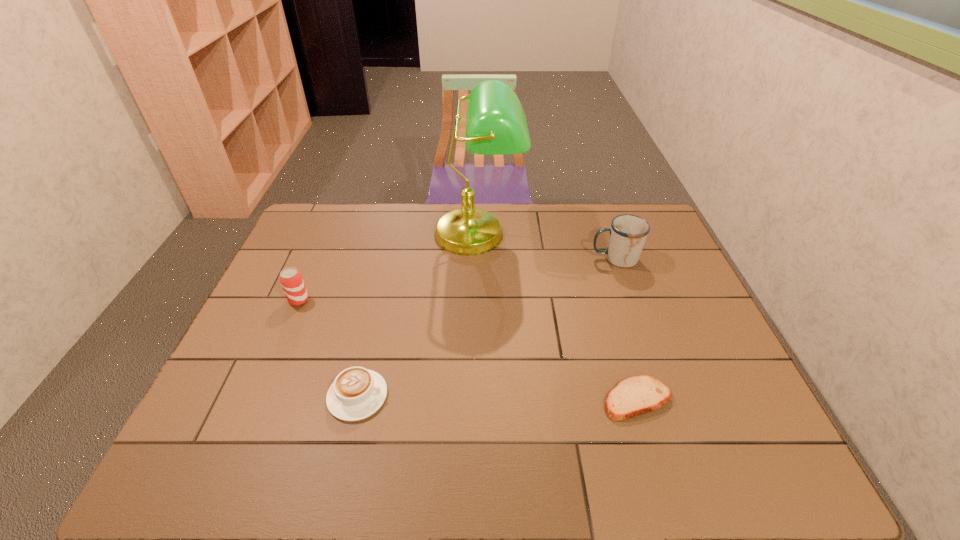
Locate an element on the screen. The image size is (960, 540). unoccupied area between the fourth tallest object and the shortest object is located at coordinates (497, 397).

The height and width of the screenshot is (540, 960). I want to click on vacant point located between the shortest object and the third object from left to right, so click(x=557, y=316).

Locate which object is the third closest to the cappuccino. Please provide its 2D coordinates. Your answer should be formatted as a tuple, i.e. [(x, y)], where the tuple contains the x and y coordinates of a point satisfying the conditions above.

[(637, 395)]

Identify the location of the second closest object to the pita bread. The height and width of the screenshot is (540, 960). (496, 124).

Where is `free space in the image that satisfies the following two spatial constraints: 1. on the desk next to the lamp; 2. with the handle on the right side of the fourth tallest object`? free space in the image that satisfies the following two spatial constraints: 1. on the desk next to the lamp; 2. with the handle on the right side of the fourth tallest object is located at coordinates (476, 396).

Find the location of a particular element. Image resolution: width=960 pixels, height=540 pixels. vacant area that satisfies the following two spatial constraints: 1. with the handle on the right side of the fourth object from right to left; 2. on the left side of the shortest object is located at coordinates (357, 399).

I want to click on free spot that satisfies the following two spatial constraints: 1. on the desk next to the third object from left to right; 2. with the handle on the right side of the fourth tallest object, so click(x=476, y=396).

This screenshot has width=960, height=540. Identify the location of vacant area that satisfies the following two spatial constraints: 1. on the back side of the pita bread; 2. with the handle on the right side of the second shortest object. (636, 396).

Where is `free point that satisfies the following two spatial constraints: 1. with the handle on the right side of the pita bread; 2. on the right side of the cappuccino`? The width and height of the screenshot is (960, 540). free point that satisfies the following two spatial constraints: 1. with the handle on the right side of the pita bread; 2. on the right side of the cappuccino is located at coordinates (357, 399).